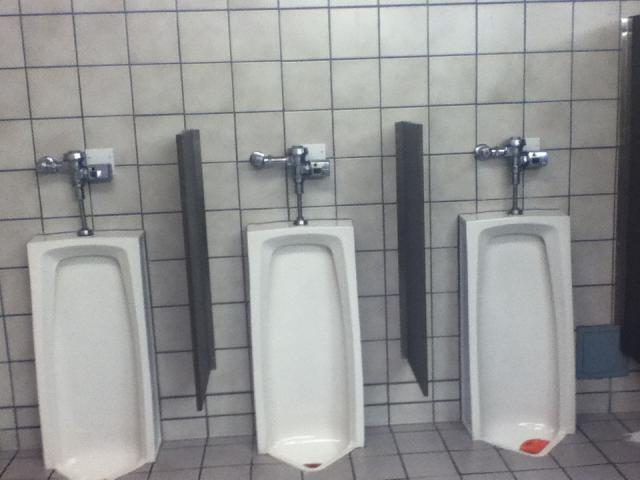
The height and width of the screenshot is (480, 640). I want to click on tiles, so click(x=109, y=78).